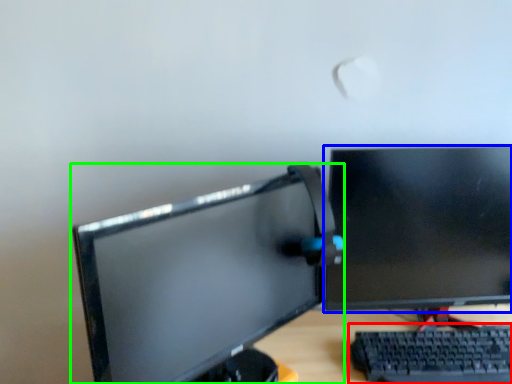
Question: Which object is the farthest from computer keyboard (highlighted by a red box)? Choose among these: computer monitor (highlighted by a blue box) or computer monitor (highlighted by a green box).

Choices:
 (A) computer monitor
 (B) computer monitor

Answer: (B)